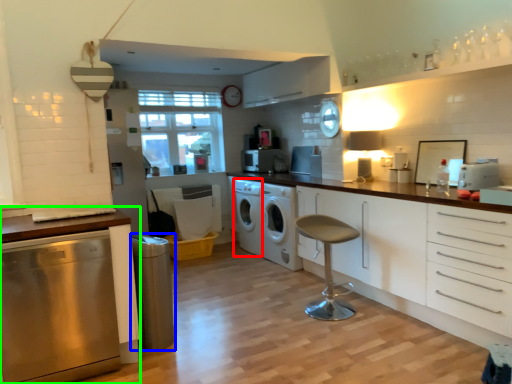
Question: Based on their relative distances, which object is nearer to washing machine (highlighted by a red box)? Choose from appliance (highlighted by a blue box) and cabinetry (highlighted by a green box).

Choices:
 (A) appliance
 (B) cabinetry

Answer: (A)